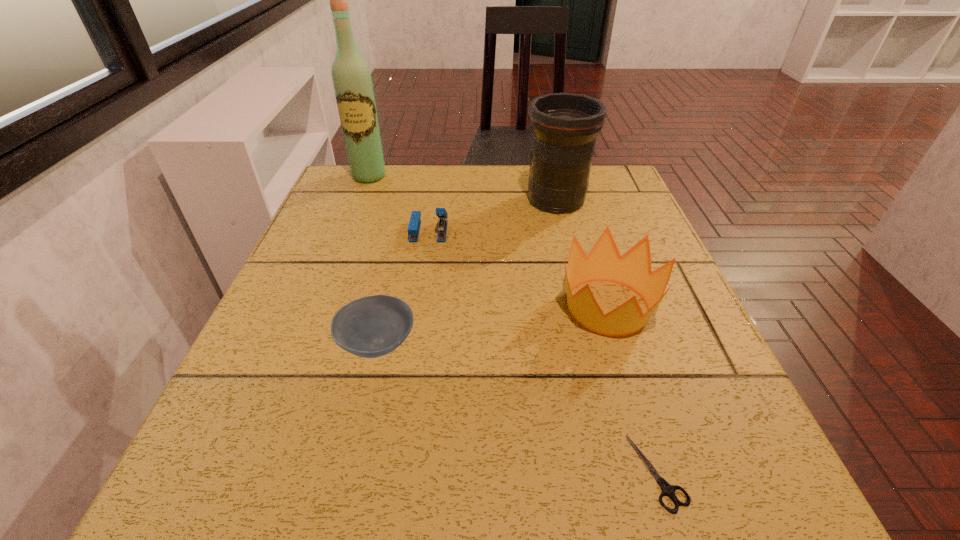
You are a GUI agent. You are given a task and a screenshot of the screen. Output one action in this format:
    pyautogui.click(x=<x>, y=<y>)
    Task: Click on the tallest object
    
    Given the screenshot: What is the action you would take?
    pyautogui.click(x=352, y=82)

Where is `wine bottle`? This screenshot has width=960, height=540. wine bottle is located at coordinates (352, 82).

Locate an element on the screen. This screenshot has width=960, height=540. the fifth shortest object is located at coordinates (564, 126).

Where is `the fourth shortest object`? the fourth shortest object is located at coordinates (633, 270).

Identify the location of the fourth nearest object. (413, 229).

What are the coordinates of `stapler` in the screenshot? It's located at (413, 229).

The height and width of the screenshot is (540, 960). What are the coordinates of `bowl` in the screenshot? It's located at (373, 326).

The width and height of the screenshot is (960, 540). I want to click on the shortest object, so click(x=668, y=490).

Where is `the nearest object`? The image size is (960, 540). the nearest object is located at coordinates (668, 490).

Find the location of a particular element. vacant space situated on the front-facing side of the leftmost object is located at coordinates (325, 289).